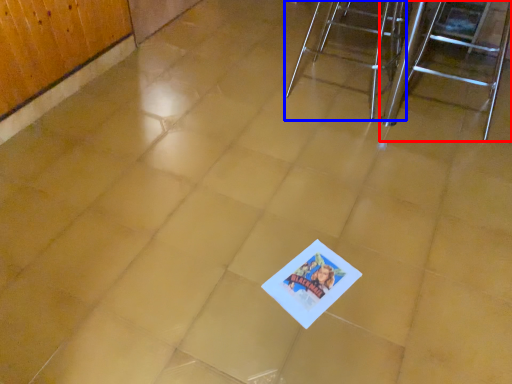
Question: Which object is closer to the camera taking this photo, furniture (highlighted by a red box) or furniture (highlighted by a blue box)?

Choices:
 (A) furniture
 (B) furniture

Answer: (A)